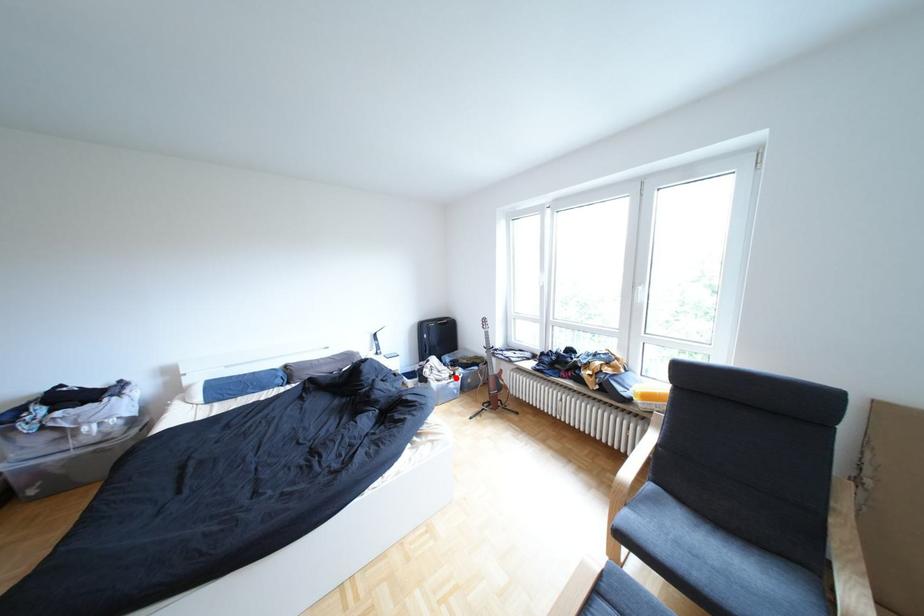
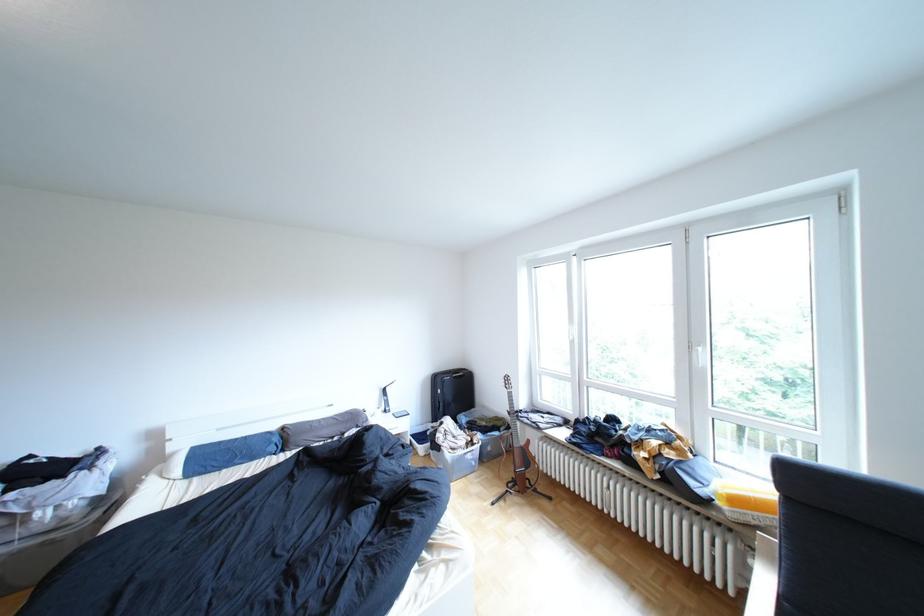
The point at the highlighted location is marked in the first image. Where is the corresponding point in the second image?

(470, 446)